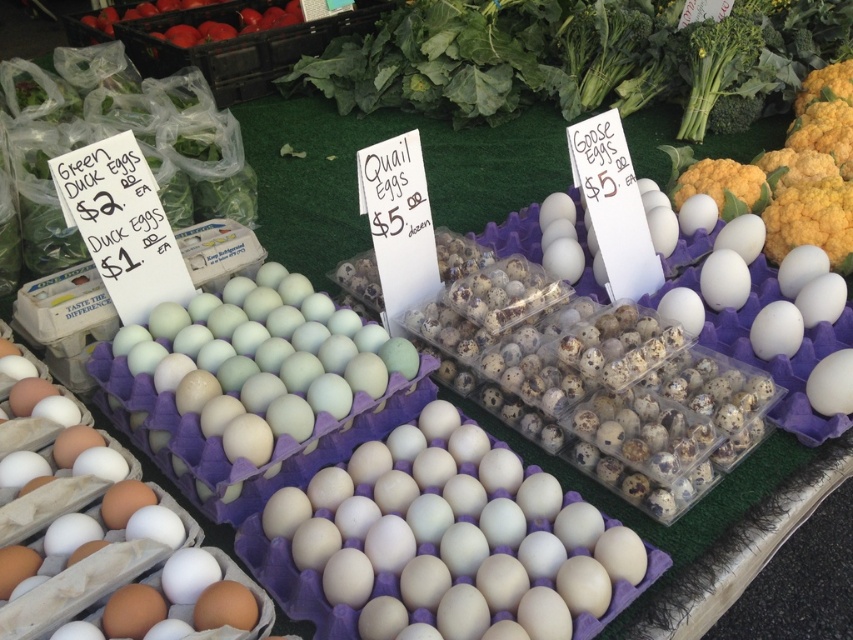
How much distance is there between red matte tomatoes at upper left and white matte egg at center?

red matte tomatoes at upper left is 8.98 feet away from white matte egg at center.

Measure the distance between red matte tomatoes at upper left and camera.

A distance of 8.72 feet exists between red matte tomatoes at upper left and camera.

Which is in front, point (221, 29) or point (825, 378)?

Positioned in front is point (825, 378).

This screenshot has height=640, width=853. I want to click on red matte tomatoes at upper left, so click(233, 26).

Is light blue matte egg at center thinner than white matte egg at center?

Incorrect, light blue matte egg at center's width is not less than white matte egg at center's.

Is light blue matte egg at center smaller than white matte egg at center?

No.

Is point (254, 410) positioned after point (815, 410)?

No, (254, 410) is closer to viewer.

At what (x,y) coordinates should I click in order to perform the action: click on light blue matte egg at center. Please return your answer as a coordinate pair (x, y). Looking at the image, I should click on (263, 358).

Is white matte eggs at center positioned in front of red matte tomatoes at upper left?

Yes.

Who is lower down, white matte eggs at center or red matte tomatoes at upper left?

white matte eggs at center is below.

Which is behind, point (514, 552) or point (167, 35)?

The point (167, 35) is behind.

Where is `white matte eggs at center`? white matte eggs at center is located at coordinates (453, 532).